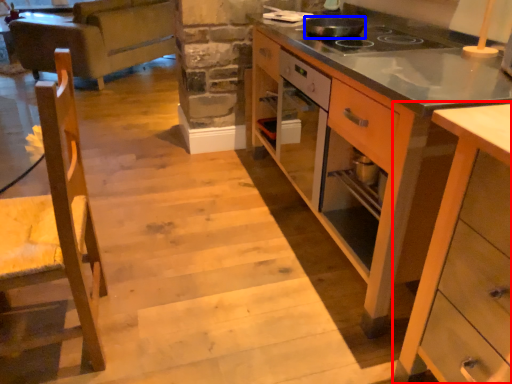
Question: Which object is further to the camera taking this photo, cabinetry (highlighted by a red box) or kitchen appliance (highlighted by a blue box)?

Choices:
 (A) cabinetry
 (B) kitchen appliance

Answer: (B)